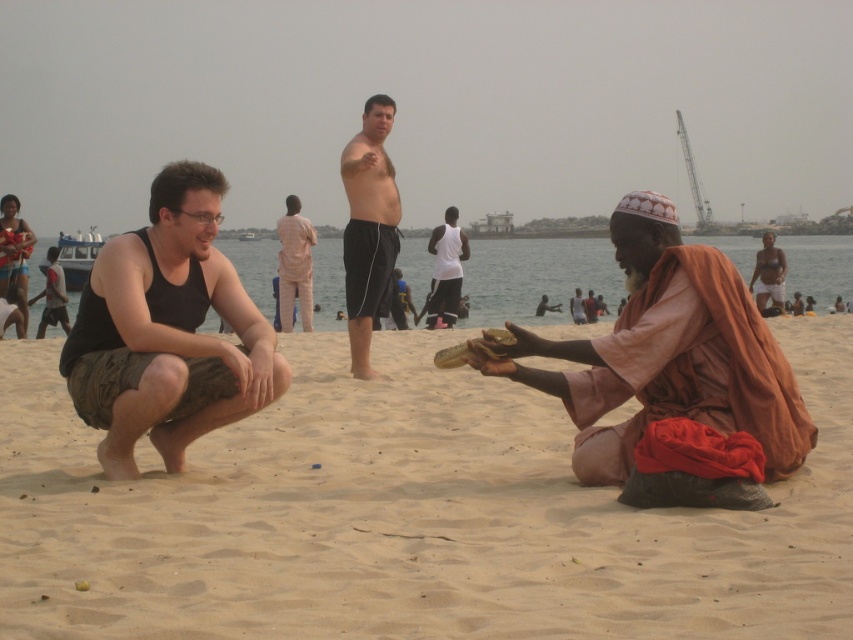
You are a photographer positioned at the beach scene. You need to capture a photo that includes both the orange fabric cloth at lower right and the smooth skin man at right. Which object should you adjust your camera focus on first to ensure both are in the frame?

Since the orange fabric cloth at lower right is closer to the viewer than the smooth skin man at right, you should focus on the orange fabric cloth at lower right first to ensure both are in the frame.